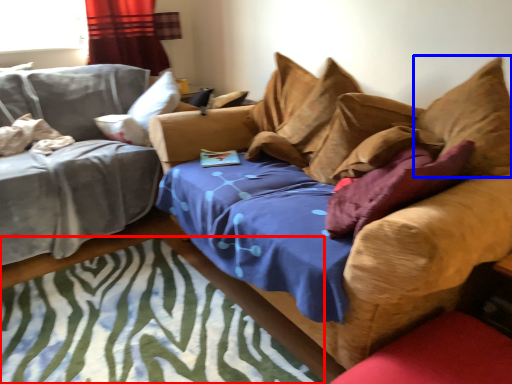
Question: Which object is closer to the camera taking this photo, mat (highlighted by a red box) or pillow (highlighted by a blue box)?

Choices:
 (A) mat
 (B) pillow

Answer: (A)